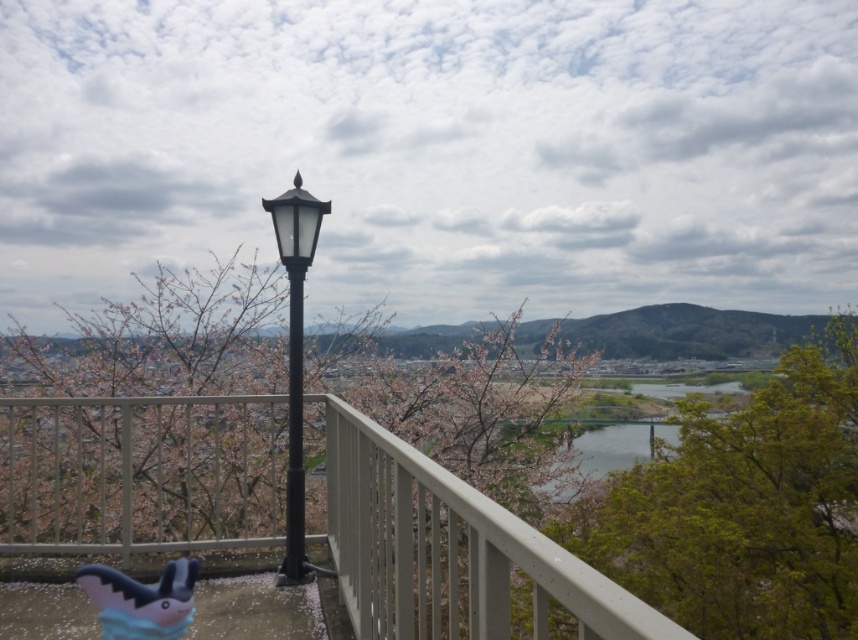
Question: Is black matte lamp post at center closer to camera compared to black metal pole at center?

Choices:
 (A) yes
 (B) no

Answer: (A)

Question: Which object is the closest to the black matte lamp post at center?

Choices:
 (A) white matte balcony at center
 (B) black metal pole at center

Answer: (B)

Question: Does white matte balcony at center come behind black metal pole at center?

Choices:
 (A) no
 (B) yes

Answer: (A)

Question: Is white matte balcony at center below black metal pole at center?

Choices:
 (A) yes
 (B) no

Answer: (A)

Question: Which object is closer to the camera taking this photo?

Choices:
 (A) black metal pole at center
 (B) white matte balcony at center
 (C) black matte lamp post at center

Answer: (B)

Question: Considering the real-world distances, which object is closest to the black metal pole at center?

Choices:
 (A) white matte balcony at center
 (B) black matte lamp post at center

Answer: (B)